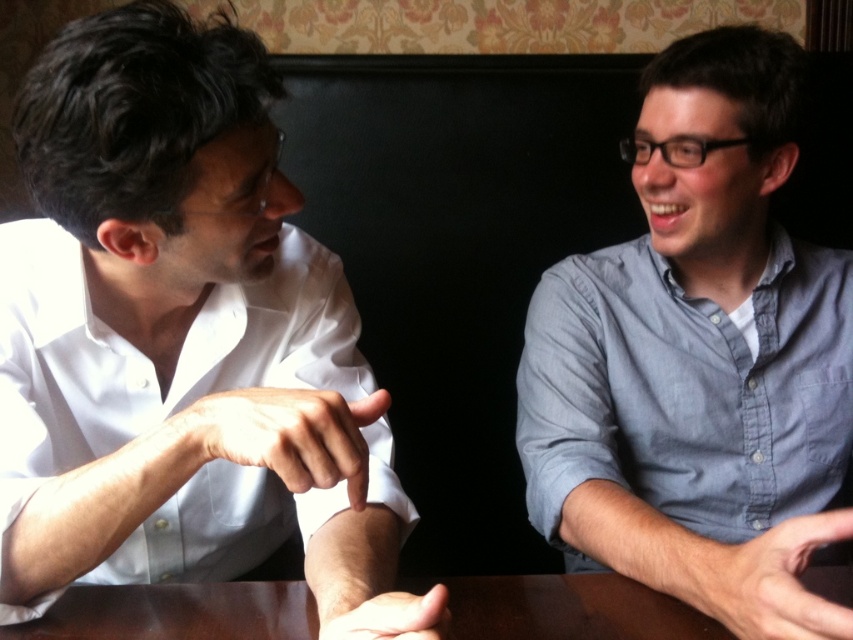
You are a customer in a restaurant and want to order a drink. The server is standing at the point marked by the coordinate point (x=699, y=358). Where should you look to find the server wearing a blue denim shirt?

The point (x=699, y=358) indicates the location of the blue denim shirt at right, so you should look towards the right side of the image to find the server wearing the blue denim shirt.

You are a waiter in a restaurant and need to place a 16 inch dessert plate between the white glossy shirt at left and the blue denim shirt at right. Can you fit the dessert plate between them without it overlapping either shirt?

The white glossy shirt at left is 17.51 inches away from the blue denim shirt at right. Since the dessert plate is 16 inches wide, it can fit between them as there is enough space.

You are a photographer trying to capture a candid shot of the two people at the table. You want to ensure that both the white glossy shirt at left and the smooth skin hand at lower center are clearly visible in the frame. Based on their positions, which object should you focus on first to ensure proper depth of field?

The white glossy shirt at left is much taller than the smooth skin hand at lower center, so focusing on the white glossy shirt at left first will help ensure proper depth of field since it is farther away and requires a narrower focus range.